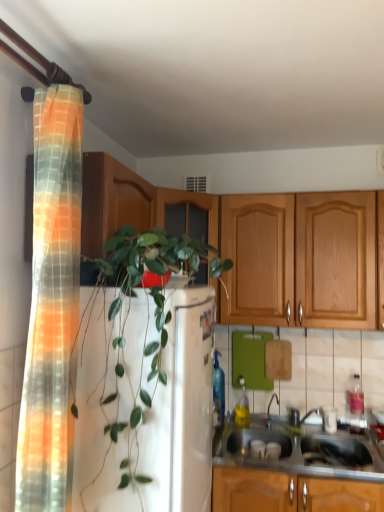
Question: Does point (269, 426) appear closer or farther from the camera than point (205, 377)?

Choices:
 (A) farther
 (B) closer

Answer: (A)

Question: In terms of height, does metallic silver faucet at sink right look taller or shorter compared to green leafy plant at center?

Choices:
 (A) tall
 (B) short

Answer: (B)

Question: Estimate the real-world distances between objects in this image. Which object is farther from the green leafy plant at center?

Choices:
 (A) metallic silver faucet at sink right
 (B) wooden cabinet at upper left
 (C) stainless steel sink at lower right
 (D) white plastic container at lower right, the second appliance from the back
 (E) green matte cutting board at center, the first appliance from the left

Answer: (D)

Question: Which of these objects is positioned closest to the translucent orange-yellow fabric at left?

Choices:
 (A) green matte cutting board at center, the first appliance from the left
 (B) stainless steel sink at lower right
 (C) metallic silver faucet at sink right
 (D) white plastic container at lower right, the 1th appliance positioned from the right
 (E) wooden cabinet at upper left

Answer: (E)